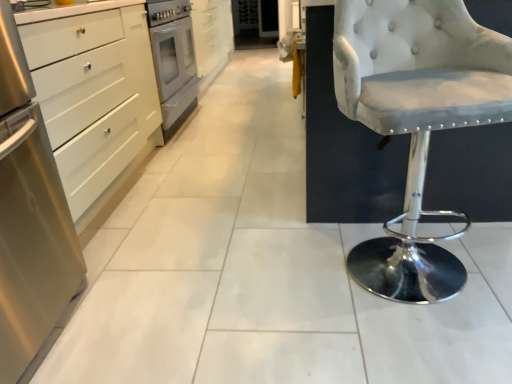
At what (x,y) coordinates should I click in order to perform the action: click on free space in front of white tufted fabric stool at right. Please return your answer as a coordinate pair (x, y). Image resolution: width=512 pixels, height=384 pixels. Looking at the image, I should click on (418, 337).